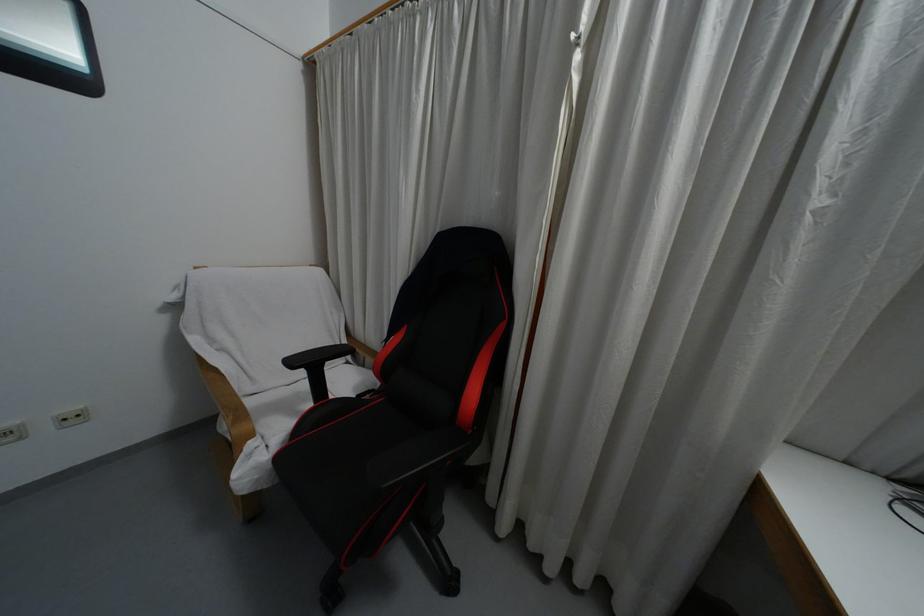
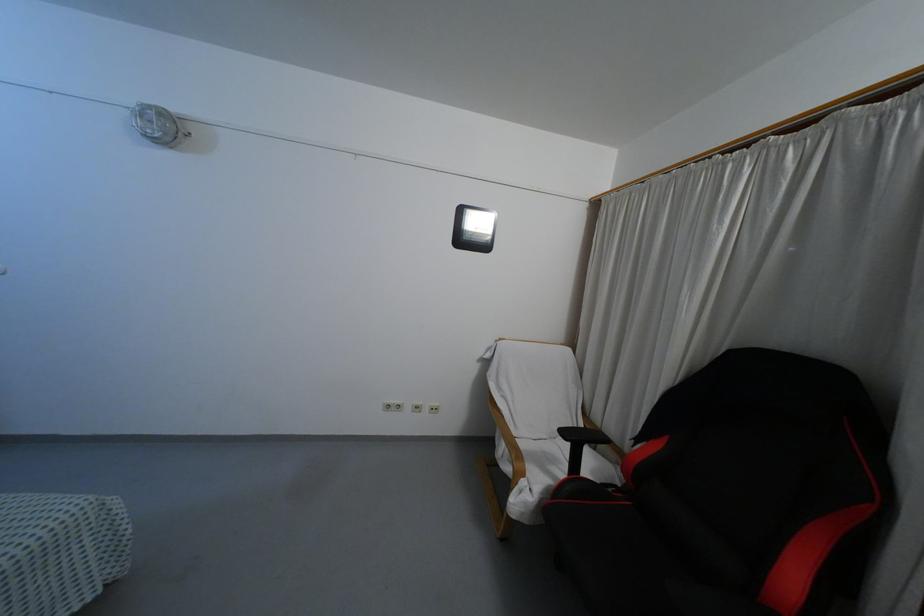
Question: The camera is either moving clockwise (left) or counter-clockwise (right) around the object. The first image is from the beginning of the video and the second image is from the end. Is the camera moving left or right when shooting the video?

Choices:
 (A) Left
 (B) Right

Answer: (B)